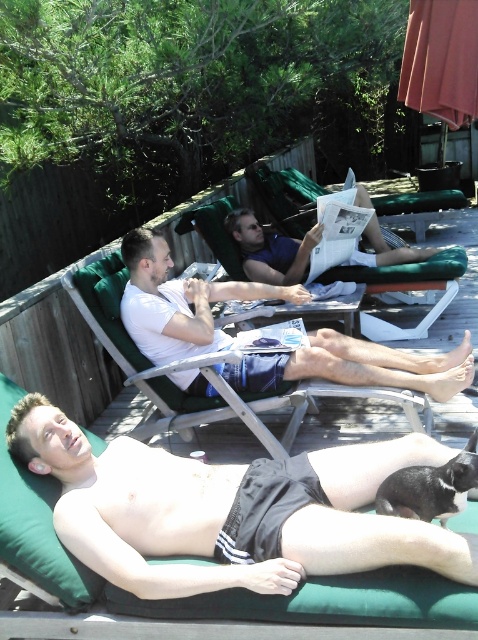
You are a photographer taking a picture of the scene. You want to focus on the black matte shorts at center and the white matte shirt at center. Which one is positioned to the left of the other?

The black matte shorts at center is to the left of white matte shirt at center.

You are planning to buy a new outfit and want to ensure it fits well. You see a black matte shorts at center and a white matte shirt at center in the image. Which item has a smaller width?

The black matte shorts at center has a smaller width than the white matte shirt at center.

You are planning to place a new decorative item on the deck. The item requires a space taller than the black matte shorts at center but shorter than the green fabric beach chair at center. Is there enough vertical space between them for this item?

The black matte shorts at center is shorter than the green fabric beach chair at center, so there is enough vertical space between them to place the decorative item.